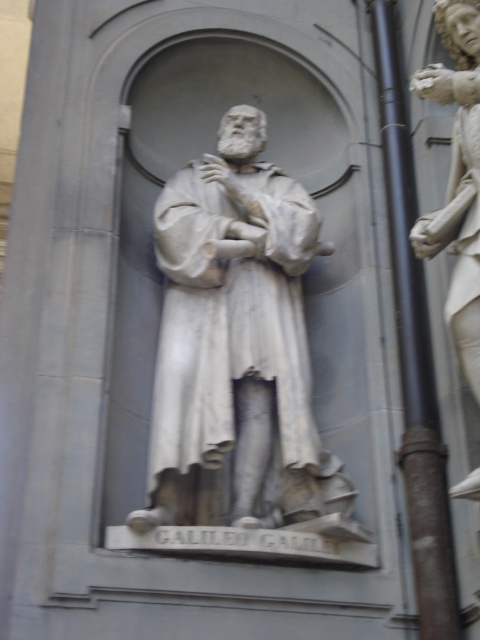
Is white marble statue at center above black metal pole at right?

No.

Is white marble statue at center shorter than black metal pole at right?

Indeed, white marble statue at center has a lesser height compared to black metal pole at right.

Is point (282, 182) more distant than point (407, 266)?

Yes, it is behind point (407, 266).

You are a GUI agent. You are given a task and a screenshot of the screen. Output one action in this format:
    pyautogui.click(x=<x>, y=<y>)
    Task: Click on the white marble statue at center
    
    Given the screenshot: What is the action you would take?
    pyautogui.click(x=236, y=340)

Is white marble statue at center positioned behind white marble statue at right?

Yes, white marble statue at center is behind white marble statue at right.

Which is more to the left, white marble statue at center or white marble statue at right?

white marble statue at center

Is point (210, 305) farther from camera compared to point (443, 228)?

Yes, point (210, 305) is behind point (443, 228).

I want to click on white marble statue at center, so click(x=236, y=340).

In the scene shown: Is black metal pole at right above white marble statue at right?

No, black metal pole at right is not above white marble statue at right.

Which of these two, black metal pole at right or white marble statue at right, stands shorter?

With less height is white marble statue at right.

Does point (428, 369) come closer to viewer compared to point (475, 168)?

No.

In order to click on black metal pole at right in this screenshot , I will do `click(415, 356)`.